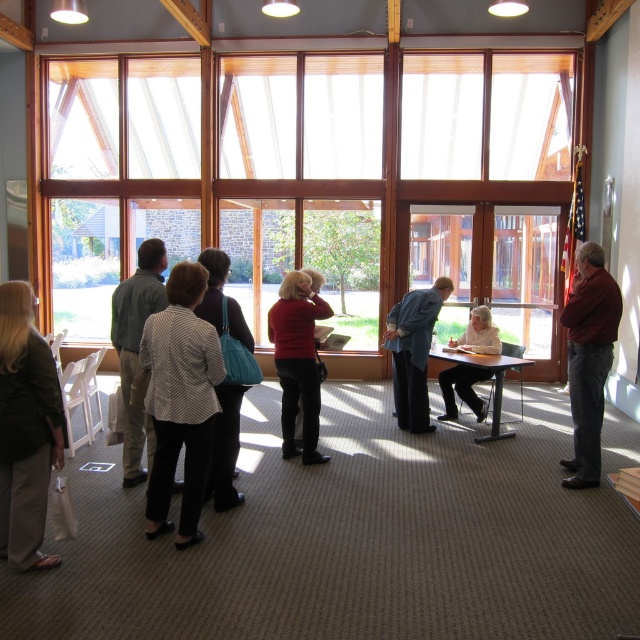
Who is taller, dark red shirt at right or patterned fabric jacket at center?

dark red shirt at right

Is dark red shirt at right below patterned fabric jacket at center?

No, dark red shirt at right is not below patterned fabric jacket at center.

I want to click on dark red shirt at right, so click(x=588, y=358).

Is dark gray suit at center above patterned fabric jacket at center?

Yes, dark gray suit at center is above patterned fabric jacket at center.

Does dark gray suit at center appear on the right side of patterned fabric jacket at center?

Correct, you'll find dark gray suit at center to the right of patterned fabric jacket at center.

Describe the element at coordinates (413, 352) in the screenshot. I see `dark gray suit at center` at that location.

You are a GUI agent. You are given a task and a screenshot of the screen. Output one action in this format:
    pyautogui.click(x=<x>, y=<y>)
    Task: Click on the dark gray suit at center
    
    Given the screenshot: What is the action you would take?
    413,352

Which of these two, clear glass window at center or patterned fabric blouse at center, stands taller?

Standing taller between the two is clear glass window at center.

Is clear glass window at center thinner than patterned fabric blouse at center?

No, clear glass window at center is not thinner than patterned fabric blouse at center.

Between point (541, 193) and point (204, 340), which one is positioned behind?

Positioned behind is point (541, 193).

At what (x,y) coordinates should I click in order to perform the action: click on clear glass window at center. Please return your answer as a coordinate pair (x, y). The width and height of the screenshot is (640, 640). Looking at the image, I should click on (352, 180).